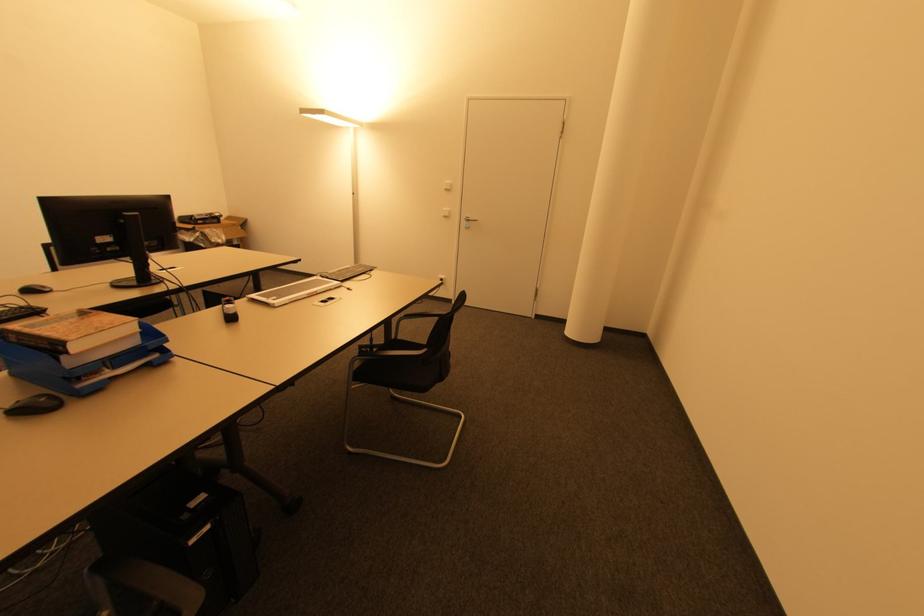
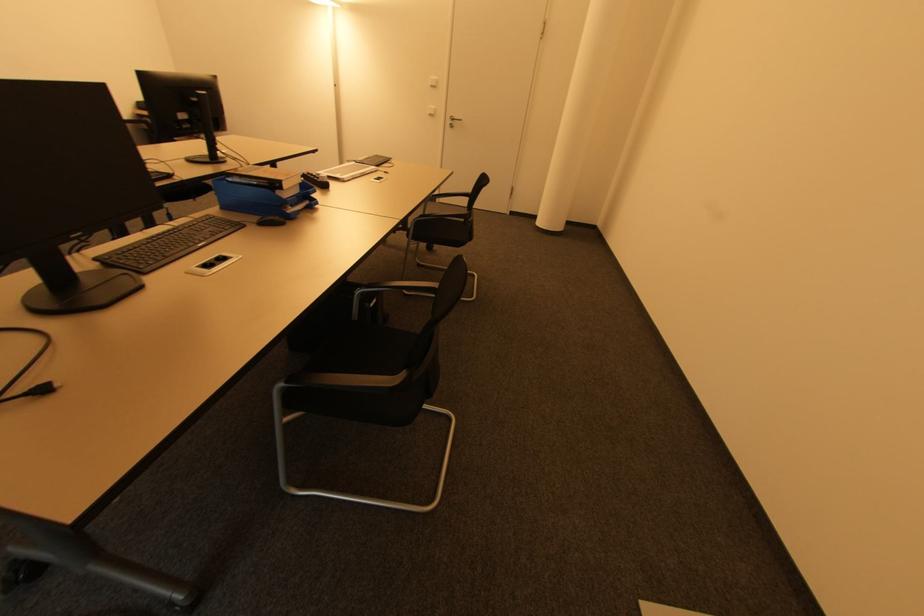
The point at [116,368] is marked in the first image. Where is the corresponding point in the second image?

(294, 207)